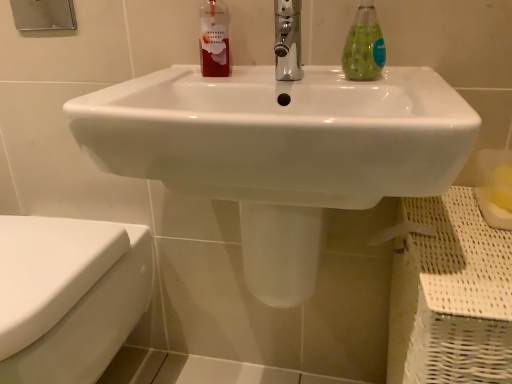
Question: Considering the relative positions of white glossy toilet at lower left and translucent green liquid at sink right in the image provided, is white glossy toilet at lower left in front of translucent green liquid at sink right?

Choices:
 (A) yes
 (B) no

Answer: (A)

Question: Is white glossy toilet at lower left at the right side of translucent green liquid at sink right?

Choices:
 (A) yes
 (B) no

Answer: (B)

Question: Does white glossy toilet at lower left have a smaller size compared to translucent green liquid at sink right?

Choices:
 (A) yes
 (B) no

Answer: (B)

Question: Is white glossy toilet at lower left far from translucent green liquid at sink right?

Choices:
 (A) no
 (B) yes

Answer: (A)

Question: Does white glossy toilet at lower left have a larger size compared to translucent green liquid at sink right?

Choices:
 (A) yes
 (B) no

Answer: (A)

Question: Is white glossy toilet at lower left turned away from translucent green liquid at sink right?

Choices:
 (A) no
 (B) yes

Answer: (A)

Question: Is white glossy sink at center next to translucent green liquid at sink right and touching it?

Choices:
 (A) yes
 (B) no

Answer: (B)

Question: From a real-world perspective, is white glossy sink at center physically above translucent green liquid at sink right?

Choices:
 (A) no
 (B) yes

Answer: (A)

Question: Can translucent green liquid at sink right be found inside white glossy sink at center?

Choices:
 (A) yes
 (B) no

Answer: (B)

Question: Is white glossy sink at center wider than translucent green liquid at sink right?

Choices:
 (A) yes
 (B) no

Answer: (A)

Question: Considering the relative sizes of white glossy sink at center and translucent green liquid at sink right in the image provided, is white glossy sink at center smaller than translucent green liquid at sink right?

Choices:
 (A) yes
 (B) no

Answer: (B)

Question: Is white glossy sink at center to the left of translucent green liquid at sink right from the viewer's perspective?

Choices:
 (A) no
 (B) yes

Answer: (B)

Question: Does chrome metallic faucet at center turn towards translucent green liquid at sink right?

Choices:
 (A) yes
 (B) no

Answer: (B)